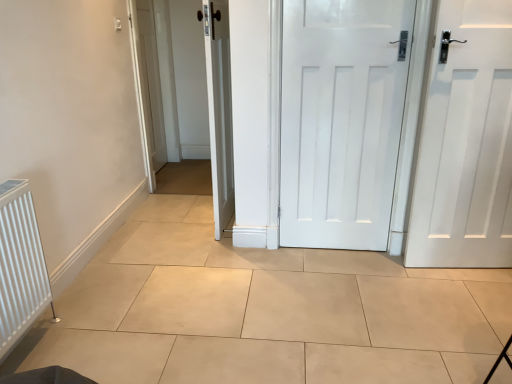
Question: From the image's perspective, is white matte door at center, the 2th door from the right, positioned above or below white ribbed radiator at left?

Choices:
 (A) below
 (B) above

Answer: (B)

Question: From their relative heights in the image, would you say white matte door at center, marked as the second door in a left-to-right arrangement, is taller or shorter than white ribbed radiator at left?

Choices:
 (A) tall
 (B) short

Answer: (A)

Question: Which is nearer to the white wooden door at center, which is counted as the 3th door, starting from the right?

Choices:
 (A) white ribbed radiator at left
 (B) white matte door at right, which is the 1th door in right-to-left order
 (C) white matte door at center, the 2th door from the right

Answer: (C)

Question: Considering the real-world distances, which object is closest to the white wooden door at center, the 1th door in the left-to-right sequence?

Choices:
 (A) white matte door at center, marked as the second door in a left-to-right arrangement
 (B) white matte door at right, placed as the third door when sorted from left to right
 (C) white ribbed radiator at left

Answer: (A)